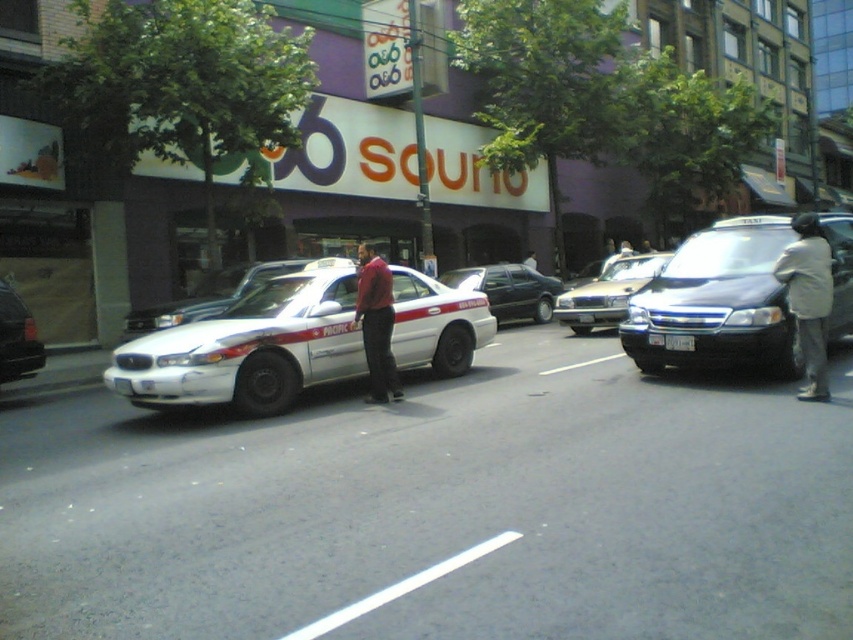
You are a delivery person who needs to park your van between the white glossy sedan at center and the shiny black sedan at center right. Is there enough space between them for your van which is 5 meters long?

The white glossy sedan at center is positioned under the shiny black sedan at center right, meaning they are likely parked one behind the other rather than side by side. Since they are not parked next to each other, there is no space between them for your van to park. You will need to look for another parking spot.

You are a delivery person needing to park your van between the shiny black sedan at center right and the gold metallic sedan at center. Can you fit your van, which is 6 meters long, in the space between them?

The shiny black sedan at center right is located above the gold metallic sedan at center, so there is no horizontal space between them for the van to park. The van cannot fit between them.